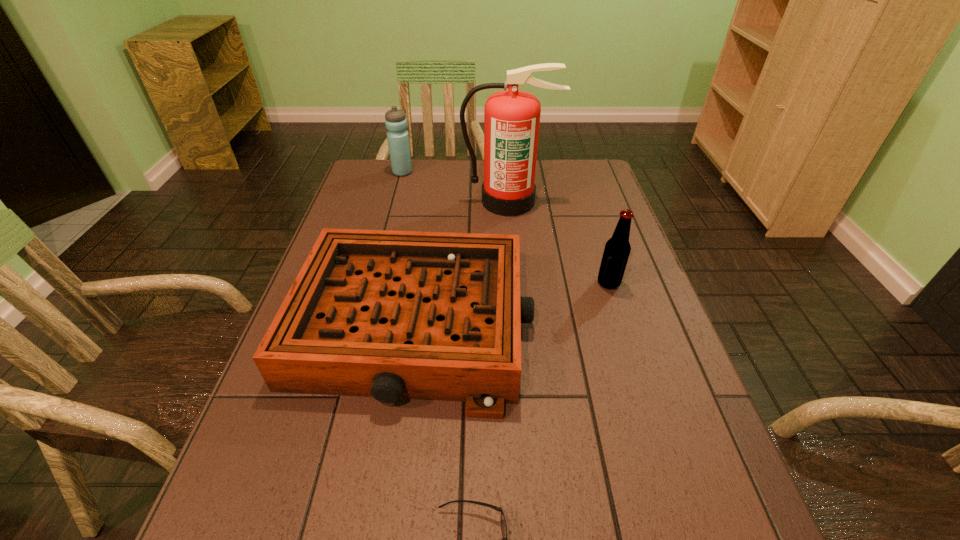
Where is `the second farthest object`? The width and height of the screenshot is (960, 540). the second farthest object is located at coordinates (511, 117).

Find the location of a particular element. This screenshot has height=540, width=960. fire extinguisher is located at coordinates (511, 117).

You are a GUI agent. You are given a task and a screenshot of the screen. Output one action in this format:
    pyautogui.click(x=<x>, y=<y>)
    Task: Click on the water bottle
    
    Given the screenshot: What is the action you would take?
    pyautogui.click(x=395, y=120)

Find the location of a particular element. the rightmost object is located at coordinates click(x=617, y=249).

This screenshot has height=540, width=960. I want to click on the second shortest object, so click(x=392, y=315).

Locate an element on the screen. This screenshot has height=540, width=960. vacant region located at the nozzle of the tallest object is located at coordinates (515, 264).

This screenshot has height=540, width=960. I want to click on vacant space located 0.210m on the right of the farthest object, so click(x=473, y=172).

The width and height of the screenshot is (960, 540). Identify the location of vacant space situated on the left of the beer bottle. (537, 283).

This screenshot has height=540, width=960. Identify the location of vacant space located 0.170m on the front of the fourth tallest object. (387, 517).

I want to click on fire extinguisher that is at the far edge, so click(x=511, y=117).